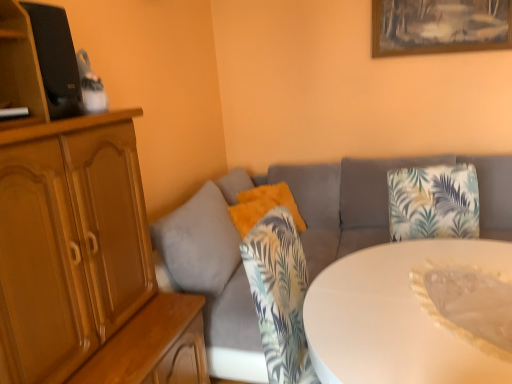
Question: Does point (198, 240) appear closer or farther from the camera than point (397, 34)?

Choices:
 (A) farther
 (B) closer

Answer: (B)

Question: From their relative heights in the image, would you say gray fabric couch at center is taller or shorter than wooden picture frame at upper center?

Choices:
 (A) short
 (B) tall

Answer: (B)

Question: Which of these objects is positioned farthest from the gray fabric couch at center?

Choices:
 (A) wooden cabinet at upper left
 (B) wooden picture frame at upper center
 (C) fuzzy orange pillow at center
 (D) white glossy table at center

Answer: (A)

Question: Which object is positioned closest to the wooden picture frame at upper center?

Choices:
 (A) fuzzy orange pillow at center
 (B) wooden cabinet at upper left
 (C) white glossy table at center
 (D) gray fabric couch at center

Answer: (D)